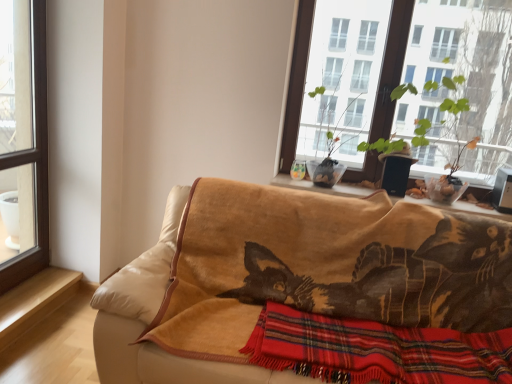
Question: In terms of size, does transparent glass window at upper center, which appears as the second window when viewed from the left, appear bigger or smaller than wooden window sill at center, positioned as the first window sill in top-to-bottom order?

Choices:
 (A) big
 (B) small

Answer: (A)

Question: Relative to wooden window sill at center, positioned as the first window sill in top-to-bottom order, is transparent glass window at upper center, which appears as the second window when viewed from the left, in front or behind?

Choices:
 (A) behind
 (B) front

Answer: (B)

Question: Estimate the real-world distances between objects in this image. Which object is farther from the light brown wood at lower left, the 1th window sill in the left-to-right sequence?

Choices:
 (A) green leafy plant at upper right
 (B) transparent glass window at upper center, which appears as the second window when viewed from the left
 (C) wooden window sill at center, positioned as the first window sill in top-to-bottom order
 (D) transparent glass window at left, which is counted as the 2th window, starting from the right
 (E) velvet beige couch at center

Answer: (A)

Question: Based on their relative distances, which object is farther from the transparent glass window at upper center, which appears as the second window when viewed from the left?

Choices:
 (A) red plaid blanket at lower center
 (B) light brown wood at lower left, the 1th window sill in the left-to-right sequence
 (C) wooden window sill at center, the 2th window sill when ordered from bottom to top
 (D) transparent glass window at left, the first window from the left
 (E) velvet beige couch at center

Answer: (B)